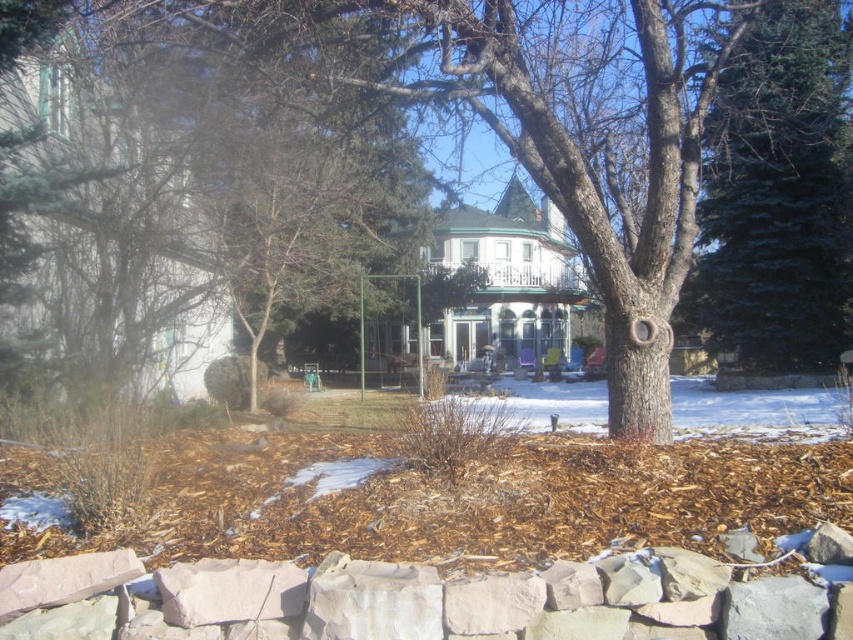
Question: Which point is closer to the camera?

Choices:
 (A) green fir tree at right
 (B) brown bark tree at center

Answer: (B)

Question: Is brown bark tree at center further to the viewer compared to green fir tree at right?

Choices:
 (A) no
 (B) yes

Answer: (A)

Question: Which point is farther to the camera?

Choices:
 (A) brown bark tree at center
 (B) green fir tree at right

Answer: (B)

Question: Is brown bark tree at center smaller than green fir tree at right?

Choices:
 (A) yes
 (B) no

Answer: (B)

Question: Is brown bark tree at center to the right of green fir tree at right from the viewer's perspective?

Choices:
 (A) yes
 (B) no

Answer: (B)